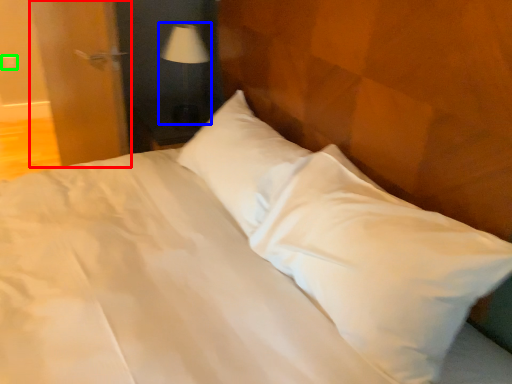
Question: Based on their relative distances, which object is farther from door (highlighted by a red box)? Choose from table lamp (highlighted by a blue box) and electric outlet (highlighted by a green box).

Choices:
 (A) table lamp
 (B) electric outlet

Answer: (B)